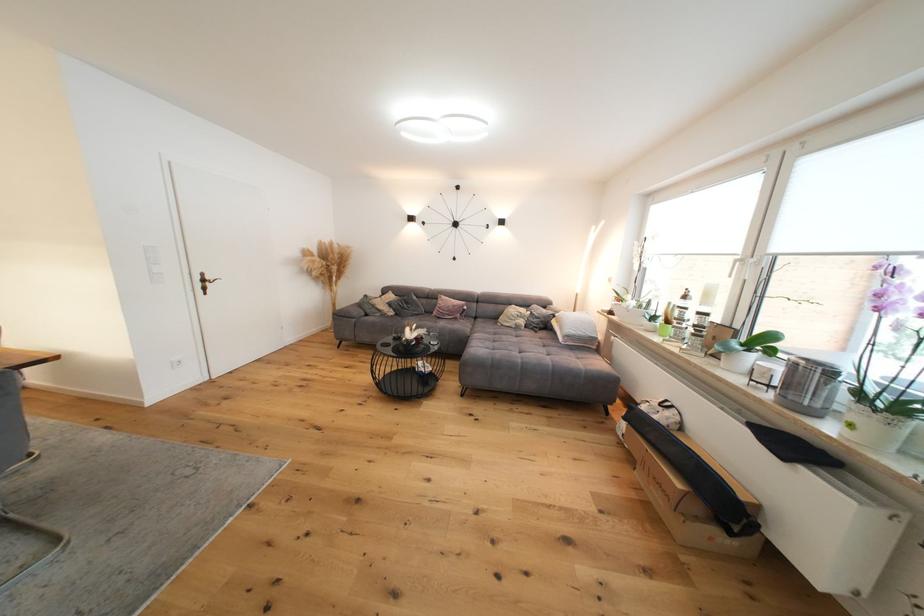
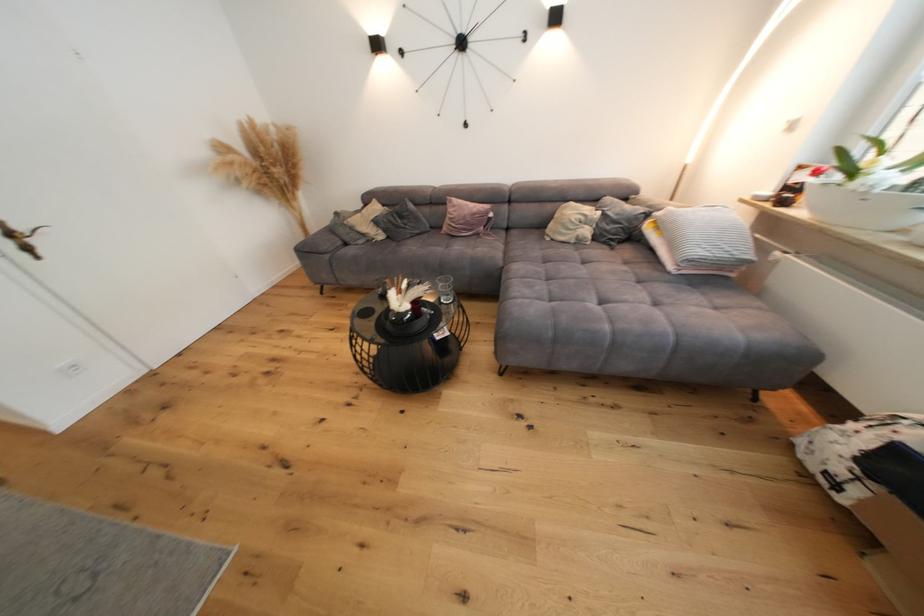
Where in the second image is the point corresponding to (x=375, y=313) from the first image?

(354, 240)